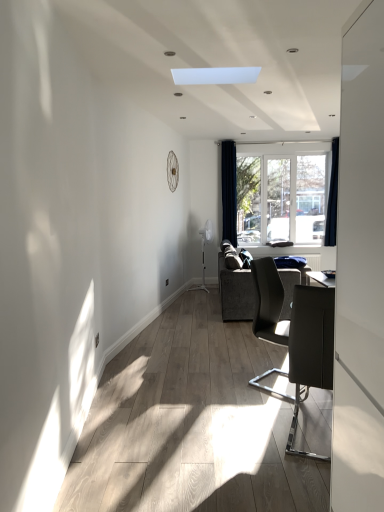
Question: Is dark gray fabric couch at center next to dark blue fabric curtain at right, the second curtain from the left?

Choices:
 (A) yes
 (B) no

Answer: (B)

Question: Is dark gray fabric couch at center not near dark blue fabric curtain at right, which is the first curtain in right-to-left order?

Choices:
 (A) yes
 (B) no

Answer: (A)

Question: Considering the relative sizes of dark gray fabric couch at center and dark blue fabric curtain at right, the second curtain from the left, in the image provided, is dark gray fabric couch at center shorter than dark blue fabric curtain at right, the second curtain from the left,?

Choices:
 (A) no
 (B) yes

Answer: (B)

Question: Would you say dark blue fabric curtain at right, the second curtain from the left, is part of dark gray fabric couch at center's contents?

Choices:
 (A) no
 (B) yes

Answer: (A)

Question: Does dark gray fabric couch at center have a greater width compared to dark blue fabric curtain at right, the second curtain from the left?

Choices:
 (A) yes
 (B) no

Answer: (A)

Question: Is the depth of dark gray fabric couch at center less than that of dark blue fabric curtain at right, which is the first curtain in right-to-left order?

Choices:
 (A) no
 (B) yes

Answer: (B)

Question: Is clear glass window at center surrounding dark blue velvet curtain at right, the first curtain when ordered from left to right?

Choices:
 (A) yes
 (B) no

Answer: (B)

Question: Can we say clear glass window at center lies outside dark blue velvet curtain at right, acting as the second curtain starting from the right?

Choices:
 (A) yes
 (B) no

Answer: (A)

Question: Considering the relative positions of clear glass window at center and dark blue velvet curtain at right, acting as the second curtain starting from the right, in the image provided, is clear glass window at center to the right of dark blue velvet curtain at right, acting as the second curtain starting from the right, from the viewer's perspective?

Choices:
 (A) yes
 (B) no

Answer: (A)

Question: Can you confirm if clear glass window at center is smaller than dark blue velvet curtain at right, the first curtain when ordered from left to right?

Choices:
 (A) yes
 (B) no

Answer: (B)

Question: Could you tell me if clear glass window at center is turned towards dark blue velvet curtain at right, acting as the second curtain starting from the right?

Choices:
 (A) yes
 (B) no

Answer: (B)

Question: From the image's perspective, is clear glass window at center located beneath dark blue velvet curtain at right, acting as the second curtain starting from the right?

Choices:
 (A) yes
 (B) no

Answer: (A)

Question: Can you confirm if dark blue velvet curtain at right, acting as the second curtain starting from the right, is wider than dark blue fabric curtain at right, which is the first curtain in right-to-left order?

Choices:
 (A) no
 (B) yes

Answer: (B)